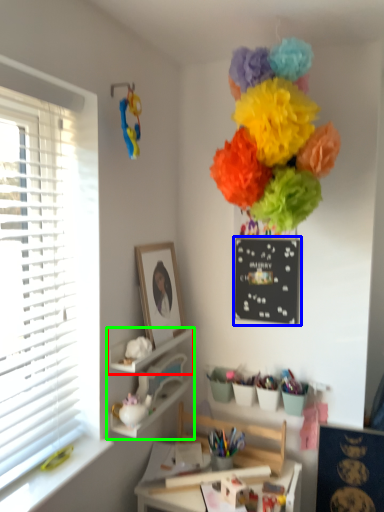
Question: Based on their relative distances, which object is farther from shelf (highlighted by a red box)? Choose from bulletin board (highlighted by a blue box) and shelf (highlighted by a green box).

Choices:
 (A) bulletin board
 (B) shelf

Answer: (A)